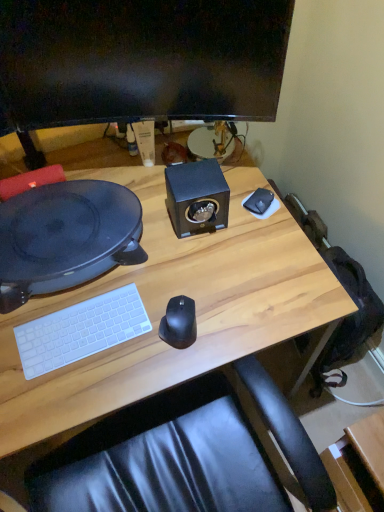
Find the location of a particular element. This screenshot has height=512, width=384. free region on the left part of black matte mouse at center is located at coordinates pyautogui.click(x=117, y=349).